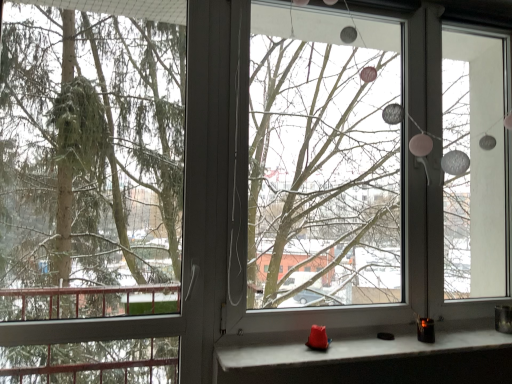
What do you see at coordinates (376, 169) in the screenshot? Image resolution: width=512 pixels, height=384 pixels. I see `transparent glass window screen at center` at bounding box center [376, 169].

Identify the location of green matte tree at left. (91, 158).

Considering the sizes of objects transparent glass window screen at center and green matte tree at left in the image provided, who is bigger, transparent glass window screen at center or green matte tree at left?

Bigger between the two is transparent glass window screen at center.

Which is in front, transparent glass window screen at center or green matte tree at left?

green matte tree at left is in front.

Is transparent glass window screen at center wider than green matte tree at left?

Incorrect, the width of transparent glass window screen at center does not surpass that of green matte tree at left.

Considering the relative positions of matte white stone at lower center and transparent glass window screen at center in the image provided, is matte white stone at lower center to the right of transparent glass window screen at center from the viewer's perspective?

Incorrect, matte white stone at lower center is not on the right side of transparent glass window screen at center.

Is matte white stone at lower center not near transparent glass window screen at center?

Absolutely, matte white stone at lower center is distant from transparent glass window screen at center.

Considering their positions, is matte white stone at lower center located in front of or behind transparent glass window screen at center?

In the image, matte white stone at lower center appears in front of transparent glass window screen at center.

From the image's perspective, is matte white stone at lower center on transparent glass window screen at center?

No, from the image's perspective, matte white stone at lower center is not above transparent glass window screen at center.

Measure the distance between transparent glass window screen at center and matte white stone at lower center.

They are 7.21 feet apart.

From the image's perspective, which one is positioned higher, transparent glass window screen at center or matte white stone at lower center?

From the image's view, transparent glass window screen at center is above.

Locate an element on the screen. The width and height of the screenshot is (512, 384). window screen above the matte white stone at lower center (from the image's perspective) is located at coordinates (376, 169).

Is transparent glass window screen at center spatially inside matte white stone at lower center, or outside of it?

transparent glass window screen at center is located beyond the bounds of matte white stone at lower center.

How many degrees apart are the facing directions of matte white stone at lower center and green matte tree at left?

The facing directions of matte white stone at lower center and green matte tree at left are 0.0878 degrees apart.

From a real-world perspective, does matte white stone at lower center sit lower than green matte tree at left?

Indeed, from a real-world perspective, matte white stone at lower center is positioned beneath green matte tree at left.

Would you say matte white stone at lower center is inside or outside green matte tree at left?

matte white stone at lower center exists outside the volume of green matte tree at left.

Considering the sizes of objects matte white stone at lower center and green matte tree at left in the image provided, who is smaller, matte white stone at lower center or green matte tree at left?

matte white stone at lower center.

How much distance is there between green matte tree at left and transparent glass window screen at center?

green matte tree at left and transparent glass window screen at center are 5.27 feet apart from each other.

From the image's perspective, is green matte tree at left on top of transparent glass window screen at center?

No, from the image's perspective, green matte tree at left is not above transparent glass window screen at center.

Is green matte tree at left not within transparent glass window screen at center?

Absolutely, green matte tree at left is external to transparent glass window screen at center.

Is green matte tree at left turned away from transparent glass window screen at center?

No, green matte tree at left is not facing away from transparent glass window screen at center.

Which of these two, green matte tree at left or matte white stone at lower center, is bigger?

green matte tree at left.

How different are the orientations of green matte tree at left and matte white stone at lower center in degrees?

green matte tree at left and matte white stone at lower center are facing 0.0878 degrees away from each other.

From a real-world perspective, is green matte tree at left positioned under matte white stone at lower center based on gravity?

No, from a real-world perspective, green matte tree at left is not under matte white stone at lower center.

You are a GUI agent. You are given a task and a screenshot of the screen. Output one action in this format:
    pyautogui.click(x=<x>, y=<y>)
    Task: Click on the tree directly beneath the transparent glass window screen at center (from a real-world perspective)
    This screenshot has height=384, width=512.
    Given the screenshot: What is the action you would take?
    pyautogui.click(x=91, y=158)

In the image, there is a matte white stone at lower center. Identify the location of window screen above it (from the image's perspective). This screenshot has width=512, height=384. (376, 169).

From the image, which object appears to be farther from transparent glass window screen at center, matte white stone at lower center or green matte tree at left?

matte white stone at lower center is further to transparent glass window screen at center.

When comparing their distances from matte white stone at lower center, does green matte tree at left or transparent glass window screen at center seem closer?

green matte tree at left is positioned closer to the anchor matte white stone at lower center.

Considering their positions, is transparent glass window screen at center positioned closer to green matte tree at left than matte white stone at lower center?

matte white stone at lower center lies closer to green matte tree at left than the other object.

Considering their positions, is matte white stone at lower center positioned further to green matte tree at left than transparent glass window screen at center?

Answer: Based on the image, transparent glass window screen at center appears to be further to green matte tree at left.

Based on their spatial positions, is green matte tree at left or matte white stone at lower center further from transparent glass window screen at center?

matte white stone at lower center lies further to transparent glass window screen at center than the other object.

From the image, which object appears to be nearer to matte white stone at lower center, transparent glass window screen at center or green matte tree at left?

Among the two, green matte tree at left is located nearer to matte white stone at lower center.

At what (x,y) coordinates should I click in order to perform the action: click on window sill between green matte tree at left and transparent glass window screen at center in the horizontal direction. Please return your answer as a coordinate pair (x, y). Image resolution: width=512 pixels, height=384 pixels. Looking at the image, I should click on (373, 360).